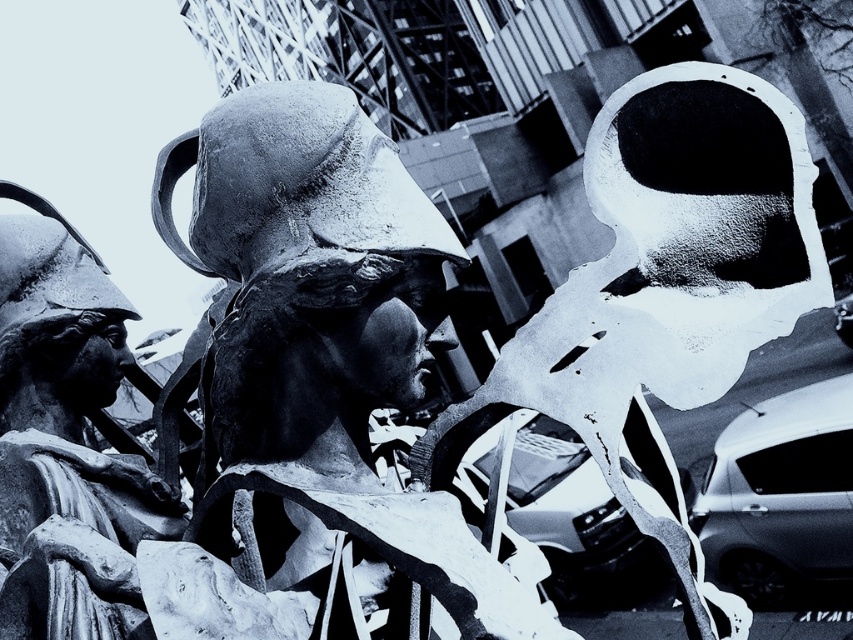
Can you confirm if smooth white mask at center is positioned above smooth stone statue at left?

Yes, smooth white mask at center is above smooth stone statue at left.

Can you confirm if smooth white mask at center is taller than smooth stone statue at left?

Yes, smooth white mask at center is taller than smooth stone statue at left.

Is point (605, 285) closer to camera compared to point (94, 554)?

Yes, it is in front of point (94, 554).

Locate an element on the screen. Image resolution: width=853 pixels, height=640 pixels. smooth white mask at center is located at coordinates (663, 294).

Does smooth stone statue at center appear on the left side of smooth stone statue at left?

No, smooth stone statue at center is not to the left of smooth stone statue at left.

Which of these two, smooth stone statue at center or smooth stone statue at left, stands taller?

smooth stone statue at center

Which is in front, point (323, 284) or point (33, 497)?

Point (323, 284) is in front.

What are the coordinates of `smooth stone statue at center` in the screenshot? It's located at (316, 381).

Can you confirm if smooth stone statue at center is thinner than smooth white mask at center?

No, smooth stone statue at center is not thinner than smooth white mask at center.

Who is more forward, (350, 140) or (704, 115)?

Point (350, 140) is in front.

Where is `smooth stone statue at center`? Image resolution: width=853 pixels, height=640 pixels. smooth stone statue at center is located at coordinates (316, 381).